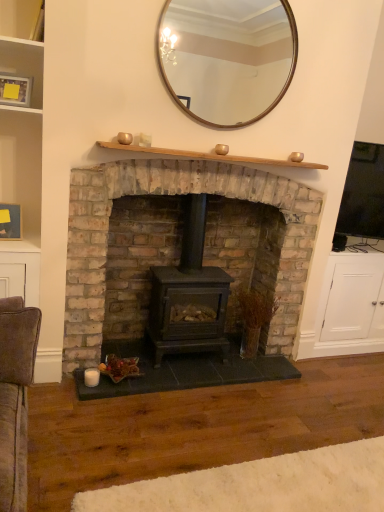
Question: Is matte black wood stove at center situated inside wooden picture frame at left, the 1th picture frame ordered from the bottom, or outside?

Choices:
 (A) inside
 (B) outside

Answer: (B)

Question: Relative to wooden picture frame at left, the first picture frame viewed from the back, is matte black wood stove at center in front or behind?

Choices:
 (A) front
 (B) behind

Answer: (A)

Question: Which is nearer to the wooden picture frame at left, the 2th picture frame in the front-to-back sequence?

Choices:
 (A) wooden shelf at upper center
 (B) matte black wood burning stove at center
 (C) white wool rug at lower center
 (D) matte black wood stove at center
 (E) matte wooden picture frame at upper left, arranged as the second picture frame when viewed from the back

Answer: (E)

Question: Which of these objects is positioned farthest from the wooden picture frame at left, arranged as the 2th picture frame when viewed from the top?

Choices:
 (A) matte black wood burning stove at center
 (B) wooden shelf at upper center
 (C) matte wooden picture frame at upper left, placed as the 2th picture frame when sorted from bottom to top
 (D) wooden-framed mirror at upper center
 (E) white wool rug at lower center

Answer: (E)